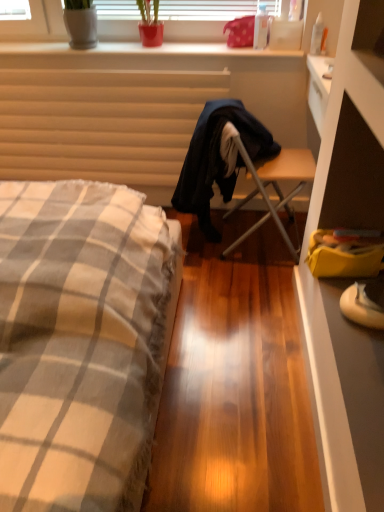
Question: Visually, is wooden folding chair at center positioned to the left or to the right of green matte plant at upper center?

Choices:
 (A) right
 (B) left

Answer: (A)

Question: From a real-world perspective, is wooden folding chair at center above or below green matte plant at upper center?

Choices:
 (A) below
 (B) above

Answer: (A)

Question: Which is farther from the white suede sneakers at lower right?

Choices:
 (A) checkered fabric bed at left
 (B) green matte plant at upper center
 (C) wooden folding chair at center
 (D) transparent plastic bottle at upper right, positioned as the second bottle in left-to-right order
 (E) transparent plastic bottle at upper center, which appears as the 1th bottle when viewed from the left

Answer: (B)

Question: Which object is the farthest from the matte beige radiator at upper left?

Choices:
 (A) wooden folding chair at center
 (B) yellow fabric bag at lower right
 (C) smooth white surface at upper center
 (D) green matte plant at upper center
 (E) dark blue fabric robe at center

Answer: (B)